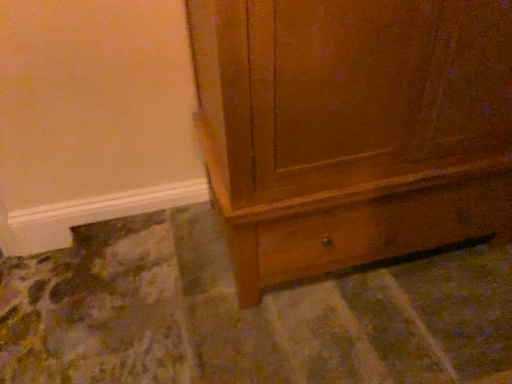
Identify the location of wooden cabinet at lower right. (352, 128).

Describe the element at coordinates (352, 128) in the screenshot. I see `wooden cabinet at lower right` at that location.

The image size is (512, 384). I want to click on wooden cabinet at lower right, so click(352, 128).